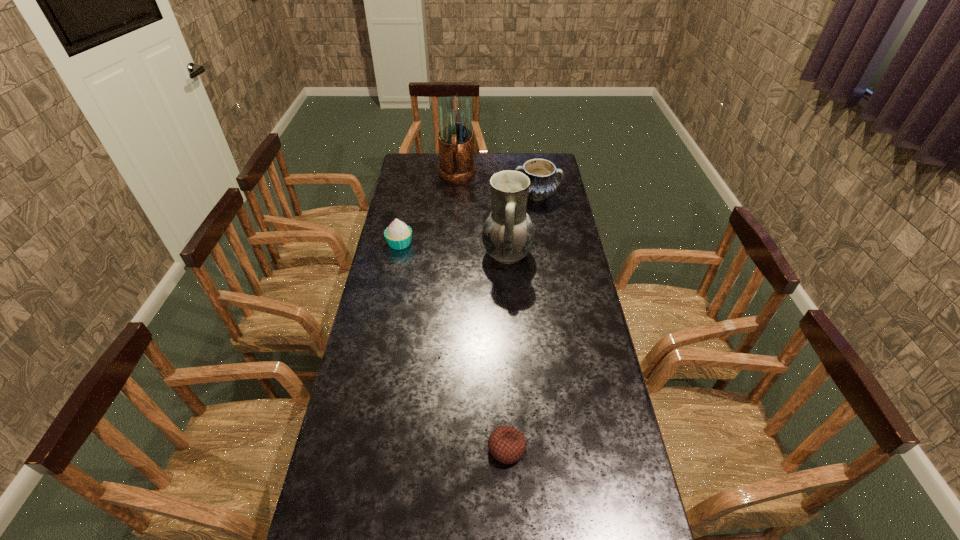
Find the location of a particular element. The image size is (960, 540). vacant area between the pottery and the second shortest object is located at coordinates (468, 220).

Locate an element on the screen. This screenshot has height=540, width=960. object that stands as the fourth closest to the leftmost object is located at coordinates (506, 444).

Select which object is the fourth closest to the fourth object from right to left. Please provide its 2D coordinates. Your answer should be formatted as a tuple, i.e. [(x, y)], where the tuple contains the x and y coordinates of a point satisfying the conditions above.

[(506, 444)]

You are a GUI agent. You are given a task and a screenshot of the screen. Output one action in this format:
    pyautogui.click(x=<x>, y=<y>)
    Task: Click on the free location that satisfies the following two spatial constraints: 1. on the back side of the third shortest object; 2. on the left side of the second shortest object
    
    Given the screenshot: What is the action you would take?
    pyautogui.click(x=410, y=196)

Locate an element on the screen. free spot that satisfies the following two spatial constraints: 1. on the front side of the pottery; 2. on the front-facing side of the nearer pitcher is located at coordinates (546, 254).